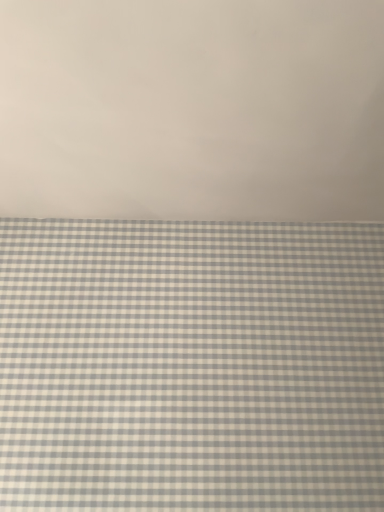
At what (x,y) coordinates should I click in order to perform the action: click on white matte paper at upper center. Please return your answer as a coordinate pair (x, y). This screenshot has height=512, width=384. Looking at the image, I should click on (192, 110).

This screenshot has width=384, height=512. What do you see at coordinates (192, 110) in the screenshot?
I see `white matte paper at upper center` at bounding box center [192, 110].

Where is `white matte paper at upper center`? The height and width of the screenshot is (512, 384). white matte paper at upper center is located at coordinates (192, 110).